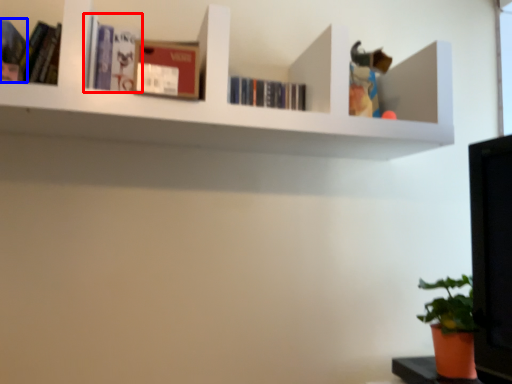
Question: Which object is further to the camera taking this photo, book (highlighted by a red box) or book (highlighted by a blue box)?

Choices:
 (A) book
 (B) book

Answer: (A)